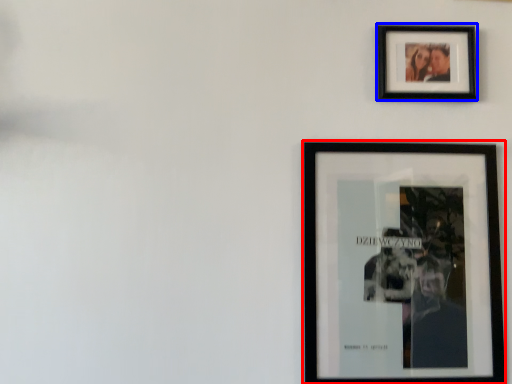
Question: Which object is closer to the camera taking this photo, picture frame (highlighted by a red box) or picture frame (highlighted by a blue box)?

Choices:
 (A) picture frame
 (B) picture frame

Answer: (A)